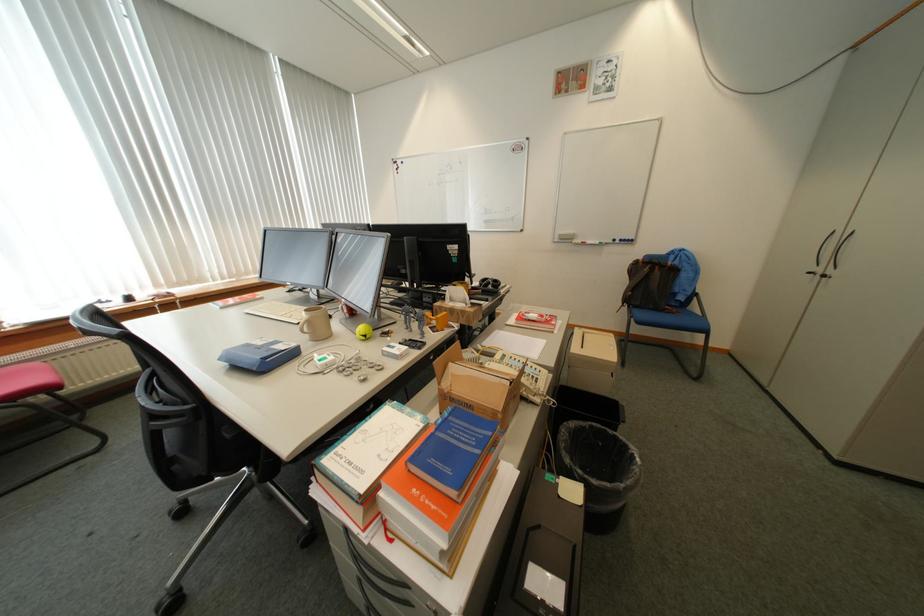
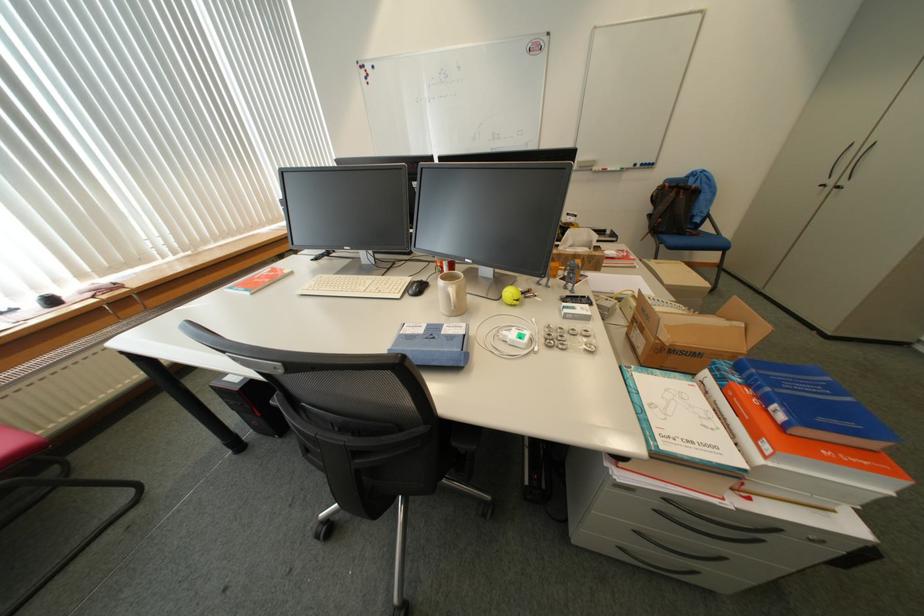
Question: I am providing you with two images of the same scene from different viewpoints. After the viewpoint changes to image2, which objects are now occluded?

Choices:
 (A) chair sitting surface
 (B) white power adapter
 (C) black backpack
 (D) none of these

Answer: (D)